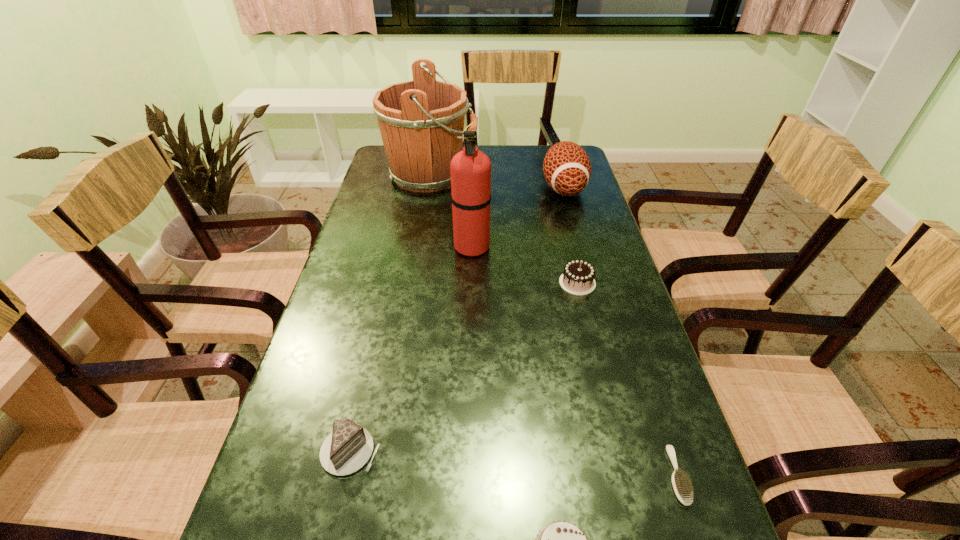
Find the location of a particular element. This screenshot has width=960, height=540. the third farthest object is located at coordinates (470, 169).

You are a GUI agent. You are given a task and a screenshot of the screen. Output one action in this format:
    pyautogui.click(x=<x>, y=<y>)
    Task: Click on the bucket
    
    Given the screenshot: What is the action you would take?
    pyautogui.click(x=419, y=121)

Find the location of `the third tallest object`. the third tallest object is located at coordinates (567, 169).

Locate an element on the screen. the tallest chocolate cake is located at coordinates (578, 276).

Locate an element on the screen. the fourth shortest object is located at coordinates (578, 276).

Find the location of a particular element. This screenshot has width=960, height=540. the leftmost chocolate cake is located at coordinates (348, 448).

You are a GUI agent. You are given a task and a screenshot of the screen. Output one action in this format:
    pyautogui.click(x=<x>, y=<y>)
    Task: Click on the second tallest chocolate cake
    
    Given the screenshot: What is the action you would take?
    pyautogui.click(x=348, y=448)

At what (x,y) coordinates should I click in order to perform the action: click on scrubbing brush. Please return your answer as a coordinate pair (x, y). Image resolution: width=960 pixels, height=540 pixels. Looking at the image, I should click on (682, 487).

Locate an element on the screen. Image resolution: width=960 pixels, height=540 pixels. vacant area situated at the nozzle of the fire extinguisher is located at coordinates (604, 246).

I want to click on free spot located 0.370m with the handle on the side of the bucket, so click(x=584, y=175).